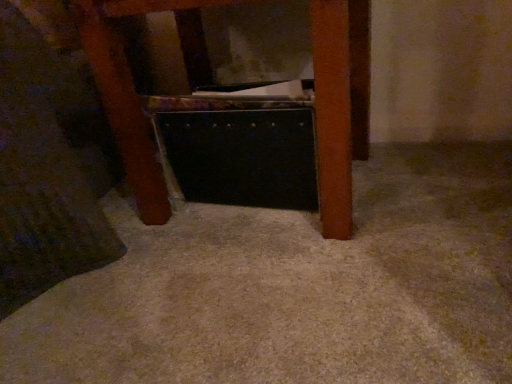
Describe the element at coordinates (340, 104) in the screenshot. I see `metallic black briefcase at center` at that location.

This screenshot has width=512, height=384. Identify the location of metallic black briefcase at center. (340, 104).

Describe the element at coordinates (241, 156) in the screenshot. I see `black plastic drawer at center` at that location.

I want to click on black plastic drawer at center, so click(241, 156).

Where is `metallic black briefcase at center`? This screenshot has height=384, width=512. metallic black briefcase at center is located at coordinates (340, 104).

Is black plastic drawer at center at the left side of metallic black briefcase at center?

No, black plastic drawer at center is not to the left of metallic black briefcase at center.

Is the depth of black plastic drawer at center less than that of metallic black briefcase at center?

No, black plastic drawer at center is behind metallic black briefcase at center.

Which is in front, point (289, 202) or point (362, 151)?

The point (289, 202) is more forward.

From the image's perspective, does black plastic drawer at center appear higher than metallic black briefcase at center?

Actually, black plastic drawer at center appears below metallic black briefcase at center in the image.

From a real-world perspective, is black plastic drawer at center below metallic black briefcase at center?

A: Correct, in the physical world, black plastic drawer at center is lower than metallic black briefcase at center.

Is black plastic drawer at center wider than metallic black briefcase at center?

In fact, black plastic drawer at center might be narrower than metallic black briefcase at center.

Who is taller, black plastic drawer at center or metallic black briefcase at center?

Standing taller between the two is metallic black briefcase at center.

Which of these two, black plastic drawer at center or metallic black briefcase at center, is bigger?

metallic black briefcase at center.

Which is correct: black plastic drawer at center is inside metallic black briefcase at center, or outside of it?

black plastic drawer at center lies within the bounds of metallic black briefcase at center.

Based on the photo, is there a large distance between black plastic drawer at center and metallic black briefcase at center?

No, there isn't a large distance between black plastic drawer at center and metallic black briefcase at center.

Is black plastic drawer at center turned away from metallic black briefcase at center?

Yes, black plastic drawer at center is facing away from metallic black briefcase at center.

Can you tell me how much black plastic drawer at center and metallic black briefcase at center differ in facing direction?

There is a 0.00158-degree angle between the facing directions of black plastic drawer at center and metallic black briefcase at center.

How much distance is there between black plastic drawer at center and metallic black briefcase at center?

black plastic drawer at center is 18.54 centimeters from metallic black briefcase at center.

Locate an element on the screen. The height and width of the screenshot is (384, 512). furniture on the left of black plastic drawer at center is located at coordinates (340, 104).

Which object is positioned more to the right, metallic black briefcase at center or black plastic drawer at center?

black plastic drawer at center is more to the right.

Is metallic black briefcase at center closer to camera compared to black plastic drawer at center?

Yes, metallic black briefcase at center is in front of black plastic drawer at center.

Does point (350, 218) come farther from viewer compared to point (231, 147)?

No.

From the image's perspective, is metallic black briefcase at center on black plastic drawer at center?

Yes.

From the picture: From a real-world perspective, is metallic black briefcase at center positioned under black plastic drawer at center based on gravity?

No, from a real-world perspective, metallic black briefcase at center is not beneath black plastic drawer at center.

Is metallic black briefcase at center wider or thinner than black plastic drawer at center?

Considering their sizes, metallic black briefcase at center looks broader than black plastic drawer at center.

Between metallic black briefcase at center and black plastic drawer at center, which one has less height?

black plastic drawer at center.

Considering the sizes of objects metallic black briefcase at center and black plastic drawer at center in the image provided, who is bigger, metallic black briefcase at center or black plastic drawer at center?

metallic black briefcase at center.

Is metallic black briefcase at center surrounding black plastic drawer at center?

That's correct, black plastic drawer at center is inside metallic black briefcase at center.

Would you say metallic black briefcase at center is a long distance from black plastic drawer at center?

No.

Is metallic black briefcase at center positioned with its back to black plastic drawer at center?

That's right, metallic black briefcase at center is facing away from black plastic drawer at center.

Measure the distance between metallic black briefcase at center and black plastic drawer at center.

The distance of metallic black briefcase at center from black plastic drawer at center is 7.30 inches.

Locate an element on the screen. Image resolution: width=512 pixels, height=384 pixels. drawer below the metallic black briefcase at center (from a real-world perspective) is located at coordinates (241, 156).

The image size is (512, 384). What are the coordinates of `drawer located on the right of metallic black briefcase at center` in the screenshot? It's located at (241, 156).

The height and width of the screenshot is (384, 512). I want to click on drawer behind the metallic black briefcase at center, so click(241, 156).